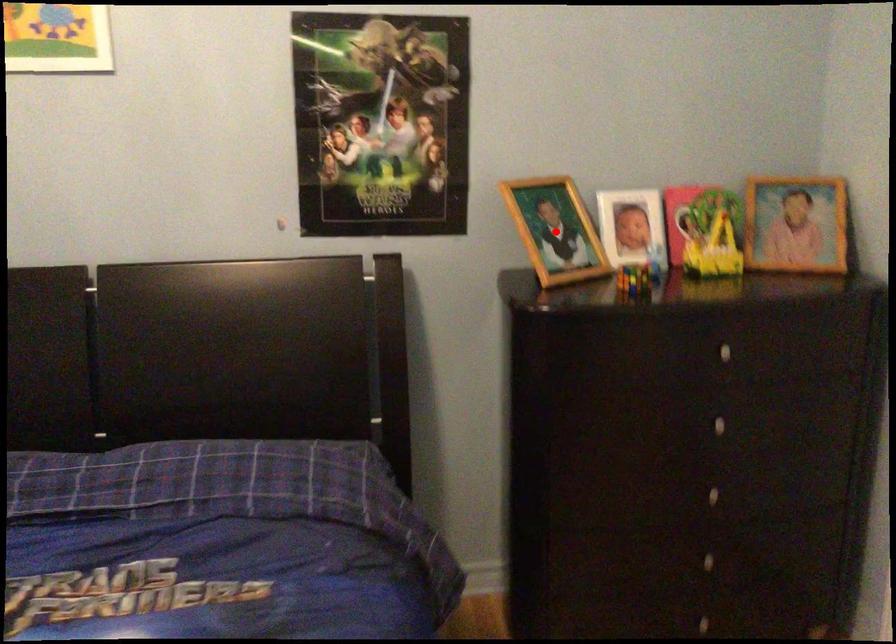
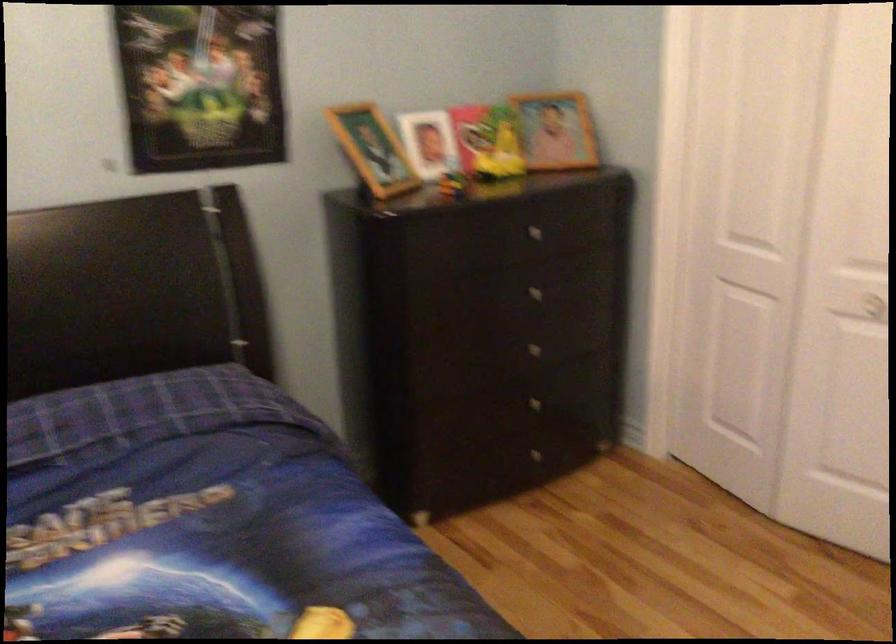
The point at the highlighted location is marked in the first image. Where is the corresponding point in the second image?

(373, 149)